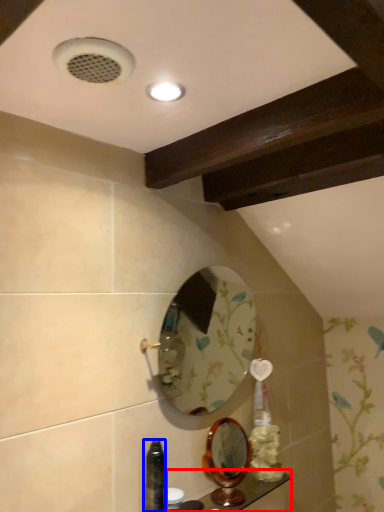
Question: Which point is further to the camera, counter top (highlighted by a red box) or bottle (highlighted by a blue box)?

Choices:
 (A) counter top
 (B) bottle

Answer: (A)